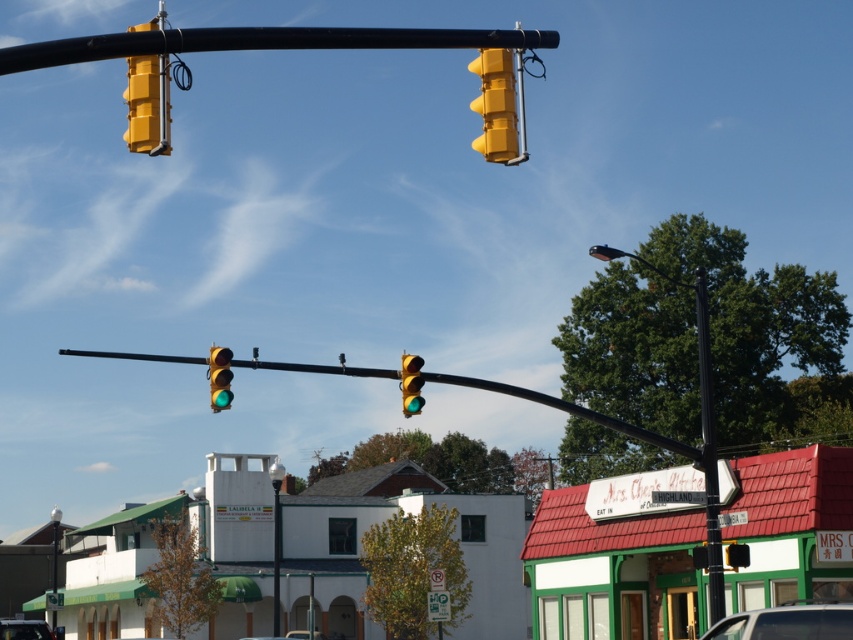
You are driving a car and see the yellow matte traffic light at upper left and the white matte car at center. Which object is positioned more to the left side of the scene?

The yellow matte traffic light at upper left is positioned more to the left than the white matte car at center.